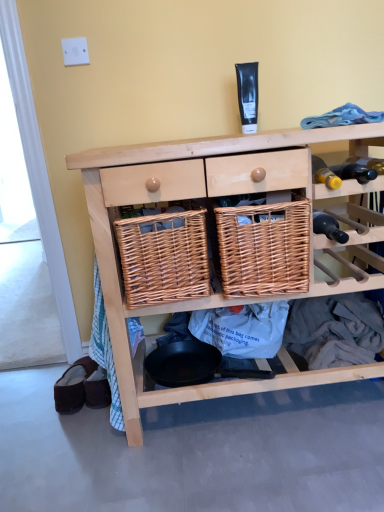
In order to face woven brown basket at center, which appears as the first basket when viewed from the right, should I rotate leftwards or rightwards?

It's best to rotate right around 8.230 degrees.

Measure the distance between brown suede slippers at lower left and camera.

brown suede slippers at lower left is 4.63 feet away from camera.

What is the approximate width of natural wood wicker baskets at center?

natural wood wicker baskets at center is 19.24 inches in width.

Locate an element on the screen. black glass bottle at right is located at coordinates (328, 227).

Where is `black matte tube at upper center`? The height and width of the screenshot is (512, 384). black matte tube at upper center is located at coordinates (248, 95).

This screenshot has width=384, height=512. I want to click on woven brown basket at center, which is counted as the second basket, starting from the left, so [x=264, y=248].

Find the location of a particular element. toiletry behind the woven brown basket at center, the 2th basket viewed from the right is located at coordinates (248, 95).

Does woven brown basket at center, which is counted as the first basket, starting from the left, have a greater width compared to black matte tube at upper center?

Indeed, woven brown basket at center, which is counted as the first basket, starting from the left, has a greater width compared to black matte tube at upper center.

Considering the sizes of objects woven brown basket at center, which is counted as the first basket, starting from the left, and black matte tube at upper center in the image provided, who is bigger, woven brown basket at center, which is counted as the first basket, starting from the left, or black matte tube at upper center?

With larger size is woven brown basket at center, which is counted as the first basket, starting from the left.

From the image's perspective, between woven brown basket at center, which appears as the first basket when viewed from the right, and brown suede slippers at lower left, who is located below?

brown suede slippers at lower left, from the image's perspective.

Considering the positions of points (244, 277) and (66, 391), is point (244, 277) farther from camera compared to point (66, 391)?

No, it is in front of (66, 391).

From the picture: Can you tell me how much woven brown basket at center, which appears as the first basket when viewed from the right, and brown suede slippers at lower left differ in facing direction?

There is a 15.7-degree angle between the facing directions of woven brown basket at center, which appears as the first basket when viewed from the right, and brown suede slippers at lower left.

Is brown suede slippers at lower left inside woven brown basket at center, which is counted as the second basket, starting from the left?

Actually, brown suede slippers at lower left is outside woven brown basket at center, which is counted as the second basket, starting from the left.

Does brown suede slippers at lower left appear on the right side of woven brown basket at center, the 2th basket viewed from the right?

Incorrect, brown suede slippers at lower left is not on the right side of woven brown basket at center, the 2th basket viewed from the right.

Is brown suede slippers at lower left far away from woven brown basket at center, the 2th basket viewed from the right?

No.

From the image's perspective, is brown suede slippers at lower left above woven brown basket at center, the 2th basket viewed from the right?

No, from the image's perspective, brown suede slippers at lower left is not above woven brown basket at center, the 2th basket viewed from the right.

How many degrees apart are the facing directions of brown suede slippers at lower left and woven brown basket at center, the 2th basket viewed from the right?

The angular difference between brown suede slippers at lower left and woven brown basket at center, the 2th basket viewed from the right, is 15.7 degrees.

Considering the relative positions of woven brown basket at center, the 2th basket viewed from the right, and brown suede slippers at lower left in the image provided, is woven brown basket at center, the 2th basket viewed from the right, to the right of brown suede slippers at lower left from the viewer's perspective?

Yes.

Is woven brown basket at center, which is counted as the first basket, starting from the left, turned away from brown suede slippers at lower left?

No, woven brown basket at center, which is counted as the first basket, starting from the left, is not facing the opposite direction of brown suede slippers at lower left.

From their relative heights in the image, would you say woven brown basket at center, the 2th basket viewed from the right, is taller or shorter than brown suede slippers at lower left?

woven brown basket at center, the 2th basket viewed from the right, is taller than brown suede slippers at lower left.

Which object is wider, woven brown basket at center, which is counted as the first basket, starting from the left, or brown suede slippers at lower left?

Wider between the two is woven brown basket at center, which is counted as the first basket, starting from the left.

Between woven brown basket at center, which is counted as the second basket, starting from the left, and black glass bottle at right, which one has more height?

woven brown basket at center, which is counted as the second basket, starting from the left.

Consider the image. Can you tell me how much woven brown basket at center, which is counted as the second basket, starting from the left, and black glass bottle at right differ in facing direction?

The angle between the facing direction of woven brown basket at center, which is counted as the second basket, starting from the left, and the facing direction of black glass bottle at right is 0.443 degrees.

Is woven brown basket at center, which is counted as the second basket, starting from the left, in front of or behind black glass bottle at right in the image?

Visually, woven brown basket at center, which is counted as the second basket, starting from the left, is located in front of black glass bottle at right.

Between woven brown basket at center, which is counted as the second basket, starting from the left, and black glass bottle at right, which one appears on the right side from the viewer's perspective?

From the viewer's perspective, black glass bottle at right appears more on the right side.

Considering the relative sizes of black matte tube at upper center and natural wood wicker baskets at center in the image provided, is black matte tube at upper center shorter than natural wood wicker baskets at center?

Indeed, black matte tube at upper center has a lesser height compared to natural wood wicker baskets at center.

Considering the relative positions of black matte tube at upper center and natural wood wicker baskets at center in the image provided, is black matte tube at upper center to the right of natural wood wicker baskets at center from the viewer's perspective?

No.

Which object is closer to the camera taking this photo, black matte tube at upper center or natural wood wicker baskets at center?

Positioned in front is natural wood wicker baskets at center.

Consider the image. Is black glass bottle at right inside or outside of brown suede slippers at lower left?

black glass bottle at right is located beyond the bounds of brown suede slippers at lower left.

From a real-world perspective, which is physically above, black glass bottle at right or brown suede slippers at lower left?

black glass bottle at right, from a real-world perspective.

Considering the relative sizes of black glass bottle at right and brown suede slippers at lower left in the image provided, is black glass bottle at right thinner than brown suede slippers at lower left?

Yes, black glass bottle at right is thinner than brown suede slippers at lower left.

The width and height of the screenshot is (384, 512). Identify the location of the 2nd basket directly beneath the black matte tube at upper center (from a real-world perspective). (164, 256).

Where is `footwear on the left of woven brown basket at center, which is counted as the second basket, starting from the left`? footwear on the left of woven brown basket at center, which is counted as the second basket, starting from the left is located at coordinates (73, 386).

Estimate the real-world distances between objects in this image. Which object is further from brown suede slippers at lower left, black glass bottle at right or woven brown basket at center, the 2th basket viewed from the right?

The object further to brown suede slippers at lower left is black glass bottle at right.

From the image, which object appears to be nearer to black matte tube at upper center, black glass bottle at right or brown suede slippers at lower left?

black glass bottle at right is closer to black matte tube at upper center.

Estimate the real-world distances between objects in this image. Which object is further from brown suede slippers at lower left, natural wood wicker baskets at center or woven brown basket at center, which is counted as the second basket, starting from the left?

The object further to brown suede slippers at lower left is woven brown basket at center, which is counted as the second basket, starting from the left.

Looking at this image, considering their positions, is woven brown basket at center, the 2th basket viewed from the right, positioned closer to black glass bottle at right than woven brown basket at center, which appears as the first basket when viewed from the right?

woven brown basket at center, which appears as the first basket when viewed from the right, lies closer to black glass bottle at right than the other object.

Considering their positions, is woven brown basket at center, the 2th basket viewed from the right, positioned further to black matte tube at upper center than natural wood wicker baskets at center?

Among the two, natural wood wicker baskets at center is located further to black matte tube at upper center.

Looking at the image, which one is located closer to woven brown basket at center, which is counted as the second basket, starting from the left, brown suede slippers at lower left or black matte tube at upper center?

black matte tube at upper center is positioned closer to the anchor woven brown basket at center, which is counted as the second basket, starting from the left.

Based on their spatial positions, is natural wood wicker baskets at center or brown suede slippers at lower left further from woven brown basket at center, which is counted as the second basket, starting from the left?

brown suede slippers at lower left is positioned further to the anchor woven brown basket at center, which is counted as the second basket, starting from the left.

From the image, which object appears to be nearer to black glass bottle at right, black matte tube at upper center or woven brown basket at center, which appears as the first basket when viewed from the right?

woven brown basket at center, which appears as the first basket when viewed from the right.

Find the location of a particular element. The image size is (384, 512). basket between woven brown basket at center, the 2th basket viewed from the right, and natural wood wicker baskets at center, in the horizontal direction is located at coordinates (264, 248).

You are a GUI agent. You are given a task and a screenshot of the screen. Output one action in this format:
    pyautogui.click(x=<x>, y=<y>)
    Task: Click on the basket between brown suede slippers at lower left and woven brown basket at center, which appears as the first basket when viewed from the right, in the horizontal direction
    Image resolution: width=384 pixels, height=512 pixels.
    Given the screenshot: What is the action you would take?
    pyautogui.click(x=164, y=256)

This screenshot has height=512, width=384. I want to click on shelf between woven brown basket at center, which is counted as the second basket, starting from the left, and black glass bottle at right, in the horizontal direction, so pyautogui.click(x=196, y=197).

The height and width of the screenshot is (512, 384). I want to click on basket between black matte tube at upper center and woven brown basket at center, the 2th basket viewed from the right, in the up-down direction, so click(x=264, y=248).